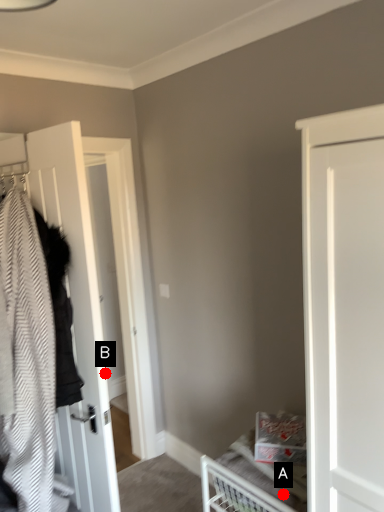
Question: Two points are circled on the image, labeled by A and B beside each circle. Which point is closer to the camera?

Choices:
 (A) A is closer
 (B) B is closer

Answer: (A)